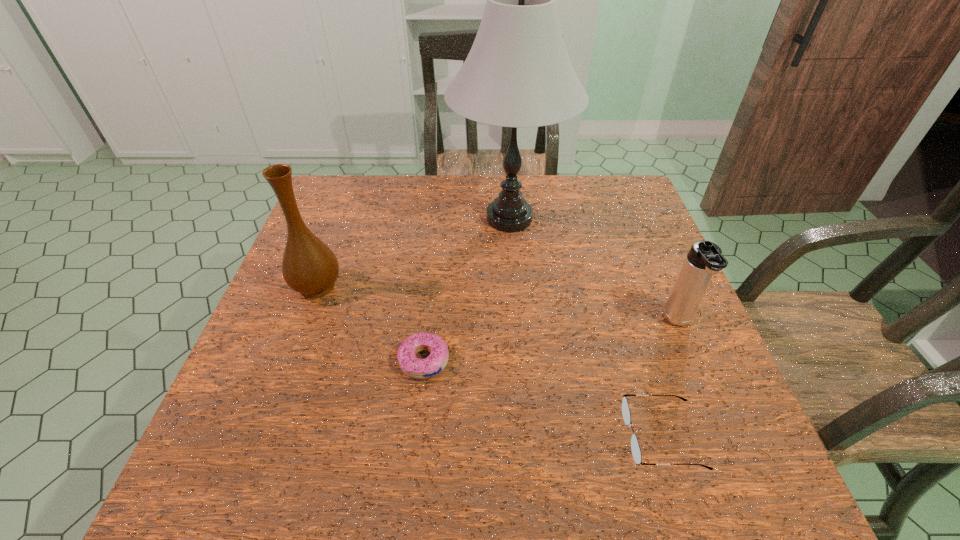
Locate an element on the screen. The width and height of the screenshot is (960, 540). free space located on the front of the vase is located at coordinates (298, 339).

At what (x,y) coordinates should I click in order to perform the action: click on vacant point located 0.330m on the handle side of the rightmost object. Please return your answer as a coordinate pair (x, y). Image resolution: width=960 pixels, height=540 pixels. Looking at the image, I should click on (754, 500).

I want to click on free space located 0.140m on the lenses of the fourth object from left to right, so click(549, 436).

Where is `vacant area situated 0.140m on the lenses of the fourth object from left to right`? This screenshot has width=960, height=540. vacant area situated 0.140m on the lenses of the fourth object from left to right is located at coordinates (549, 436).

Identify the location of vacant space positioned on the lenses of the fourth object from left to right. (565, 436).

Find the location of a particular element. vacant space located on the right of the doughnut is located at coordinates pyautogui.click(x=604, y=361).

Identify the location of object that is at the far edge. The image size is (960, 540). (517, 74).

In order to click on object that is at the near edge in this screenshot , I will do `click(635, 448)`.

Find the location of `object at the left edge`. object at the left edge is located at coordinates (309, 267).

At what (x,y) coordinates should I click in order to perform the action: click on thermos bottle that is at the right edge. Please return your answer as a coordinate pair (x, y). This screenshot has width=960, height=540. Looking at the image, I should click on (705, 259).